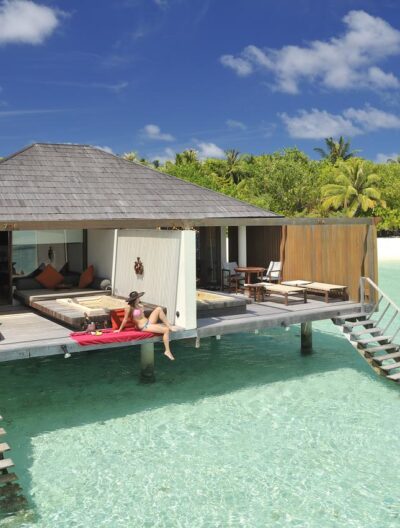
This screenshot has width=400, height=528. Identify the location of stairs. (384, 347), (4, 471).